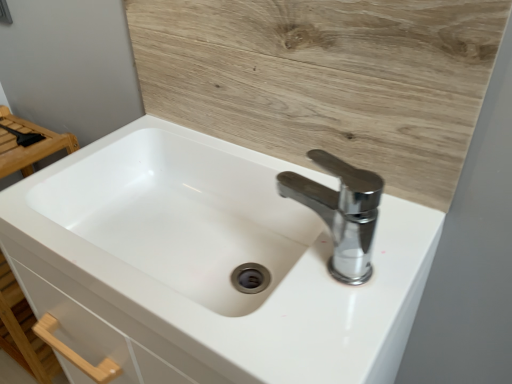
Question: Is chrome metallic faucet at upper right facing towards wooden at upper center?

Choices:
 (A) yes
 (B) no

Answer: (B)

Question: Considering the relative sizes of chrome metallic faucet at upper right and wooden at upper center in the image provided, is chrome metallic faucet at upper right wider than wooden at upper center?

Choices:
 (A) no
 (B) yes

Answer: (B)

Question: Is chrome metallic faucet at upper right positioned far away from wooden at upper center?

Choices:
 (A) no
 (B) yes

Answer: (A)

Question: From a real-world perspective, is chrome metallic faucet at upper right on top of wooden at upper center?

Choices:
 (A) no
 (B) yes

Answer: (A)

Question: Considering the relative sizes of chrome metallic faucet at upper right and wooden at upper center in the image provided, is chrome metallic faucet at upper right smaller than wooden at upper center?

Choices:
 (A) yes
 (B) no

Answer: (A)

Question: Is chrome metallic faucet at upper right with wooden at upper center?

Choices:
 (A) no
 (B) yes

Answer: (A)

Question: Is chrome metallic faucet at upper right thinner than white glossy sink at center?

Choices:
 (A) yes
 (B) no

Answer: (A)

Question: Is chrome metallic faucet at upper right oriented away from white glossy sink at center?

Choices:
 (A) yes
 (B) no

Answer: (B)

Question: Could you tell me if chrome metallic faucet at upper right is turned towards white glossy sink at center?

Choices:
 (A) yes
 (B) no

Answer: (B)

Question: From a real-world perspective, is chrome metallic faucet at upper right positioned under white glossy sink at center based on gravity?

Choices:
 (A) yes
 (B) no

Answer: (B)

Question: Is chrome metallic faucet at upper right bigger than white glossy sink at center?

Choices:
 (A) no
 (B) yes

Answer: (A)

Question: Can you confirm if chrome metallic faucet at upper right is taller than white glossy sink at center?

Choices:
 (A) no
 (B) yes

Answer: (A)

Question: Is white glossy sink at center completely or partially inside wooden at upper center?

Choices:
 (A) no
 (B) yes

Answer: (A)